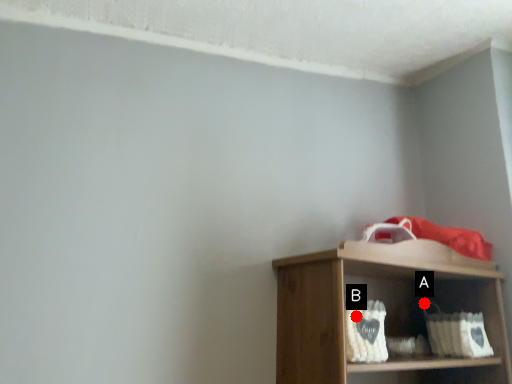
Question: Two points are circled on the image, labeled by A and B beside each circle. Which point appears closest to the camera in this image?

Choices:
 (A) A is closer
 (B) B is closer

Answer: (B)